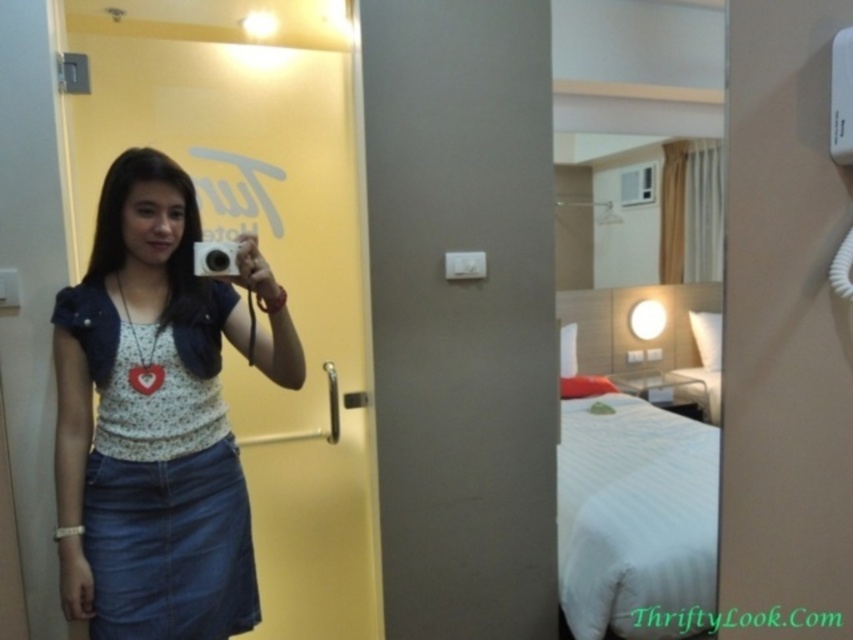
You are standing in the hotel room and want to take a selfie using the silver metallic camera at center. The denim skirt at center is blocking your view. Which direction should you move to ensure the camera can capture your entire body without obstruction?

The denim skirt at center is to the left of the silver metallic camera at center. To avoid obstruction, move to the right side so the camera can capture your entire body without the denim skirt blocking the view.

You are a photographer trying to capture a detailed image of the silver metallic camera at center and the denim skirt at center in the mirror selfie scene. Which object would appear bigger in the photo?

The denim skirt at center is larger in size than the silver metallic camera at center, so it would appear bigger in the photo.